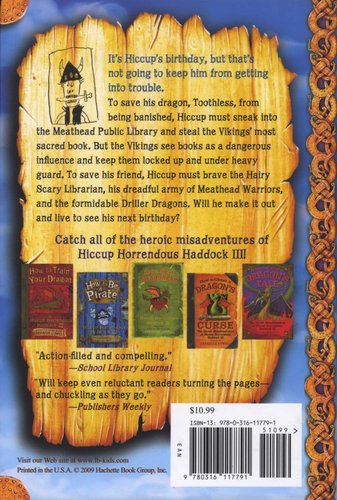
Where is `book`? The image size is (337, 500). book is located at coordinates (169, 169).